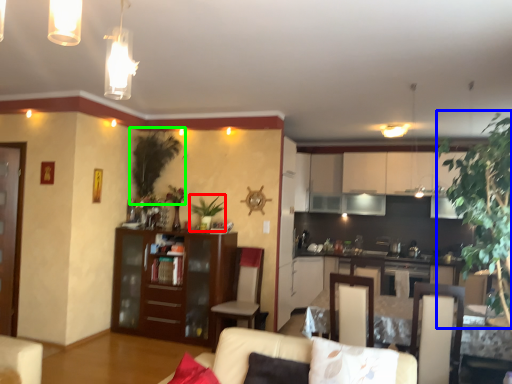
Question: Which object is positioned closest to plant (highlighted by a red box)? Select from plant (highlighted by a blue box) and plant (highlighted by a green box).

Choices:
 (A) plant
 (B) plant

Answer: (B)